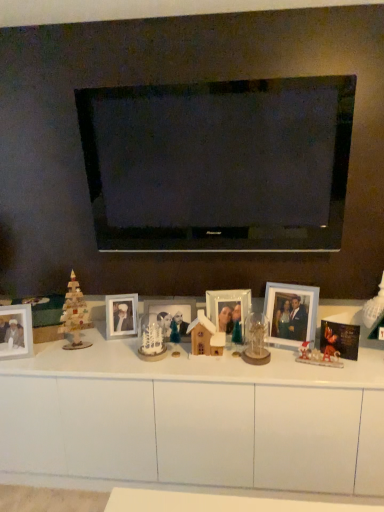
In order to click on vacant area that lies between white frosted glass christmas tree at center, which ranks as the 3th toy in right-to-left order, and wooden christmas tree at left in this screenshot , I will do `click(109, 350)`.